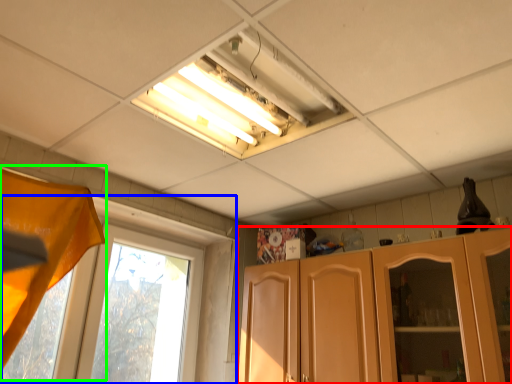
Question: Based on their relative distances, which object is farther from cabinetry (highlighted by a red box)? Choose from window (highlighted by a blue box) and curtain (highlighted by a green box).

Choices:
 (A) window
 (B) curtain

Answer: (B)